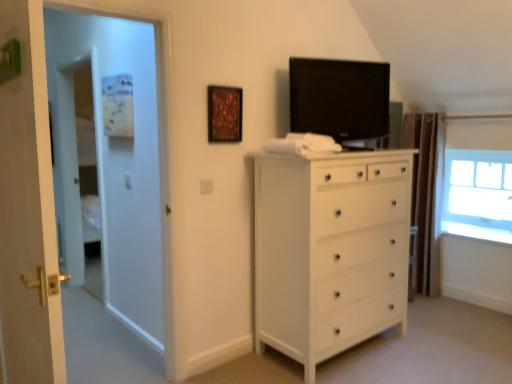
What do you see at coordinates (27, 208) in the screenshot?
I see `white wooden door at left` at bounding box center [27, 208].

Measure the distance between white glossy door at left and camera.

5.15 feet.

The width and height of the screenshot is (512, 384). Describe the element at coordinates (224, 114) in the screenshot. I see `wooden frame at upper center` at that location.

Describe the element at coordinates (477, 192) in the screenshot. Image resolution: width=512 pixels, height=384 pixels. I see `transparent glass window at upper right` at that location.

The image size is (512, 384). Describe the element at coordinates (330, 251) in the screenshot. I see `white wood chest of drawers at center` at that location.

Find the location of a particular element. white wooden door at left is located at coordinates (27, 208).

Is wooden frame at upper center further to the viewer compared to white glossy door at left?

Yes, it is.

How different are the orientations of wooden frame at upper center and white glossy door at left in degrees?

They differ by 2.53 degrees in their facing directions.

Where is `screen door located on the left of wooden frame at upper center`? screen door located on the left of wooden frame at upper center is located at coordinates (129, 159).

From a real-world perspective, is wooden frame at upper center physically above white glossy door at left?

Correct, in the physical world, wooden frame at upper center is higher than white glossy door at left.

Does brown textured curtain at right have a smaller size compared to black glossy tv at upper center?

No, brown textured curtain at right is not smaller than black glossy tv at upper center.

Is brown textured curtain at right located outside black glossy tv at upper center?

brown textured curtain at right lies outside black glossy tv at upper center's area.

Consider the image. Is brown textured curtain at right next to black glossy tv at upper center?

brown textured curtain at right and black glossy tv at upper center are clearly separated.

Is wooden frame at upper center with black glossy tv at upper center?

No.

Locate an element on the screen. picture frame below the black glossy tv at upper center (from the image's perspective) is located at coordinates (224, 114).

From a real-world perspective, which is physically above, wooden frame at upper center or black glossy tv at upper center?

In real-world perspective, black glossy tv at upper center is above.

In the scene shown: What's the angular difference between wooden frame at upper center and black glossy tv at upper center's facing directions?

The angular difference between wooden frame at upper center and black glossy tv at upper center is 12.7 degrees.

Does brown textured curtain at right turn towards white wooden door at left?

Yes, brown textured curtain at right faces towards white wooden door at left.

Considering the sizes of brown textured curtain at right and white wooden door at left in the image, is brown textured curtain at right wider or thinner than white wooden door at left?

Considering their sizes, brown textured curtain at right looks broader than white wooden door at left.

Does point (411, 263) appear closer or farther from the camera than point (27, 241)?

Point (411, 263) is positioned farther from the camera compared to point (27, 241).

Looking at this image, is brown textured curtain at right positioned far away from white wooden door at left?

Yes, brown textured curtain at right and white wooden door at left are quite far apart.

How many degrees apart are the facing directions of brown textured curtain at right and wooden frame at upper center?

90.1 degrees separate the facing orientations of brown textured curtain at right and wooden frame at upper center.

In the image, there is a wooden frame at upper center. Where is `curtain below it (from a real-world perspective)`? This screenshot has height=384, width=512. curtain below it (from a real-world perspective) is located at coordinates tap(425, 199).

Which is in front, point (413, 248) or point (239, 115)?

The point (239, 115) is more forward.

Is brown textured curtain at right located outside wooden frame at upper center?

Absolutely, brown textured curtain at right is external to wooden frame at upper center.

Which of these two, black glossy tv at upper center or transparent glass window at upper right, is thinner?

Thinner between the two is black glossy tv at upper center.

From a real-world perspective, which object rests below the other?

In real-world perspective, transparent glass window at upper right is lower.

Considering the positions of objects black glossy tv at upper center and transparent glass window at upper right in the image provided, who is behind, black glossy tv at upper center or transparent glass window at upper right?

transparent glass window at upper right is further away from the camera.

Does black glossy tv at upper center have a greater height compared to transparent glass window at upper right?

No, black glossy tv at upper center is not taller than transparent glass window at upper right.

Considering the sizes of objects brown textured curtain at right and white wood chest of drawers at center in the image provided, who is smaller, brown textured curtain at right or white wood chest of drawers at center?

Smaller between the two is brown textured curtain at right.

Which of these two, brown textured curtain at right or white wood chest of drawers at center, stands shorter?

white wood chest of drawers at center.

Consider the image. How different are the orientations of brown textured curtain at right and white wood chest of drawers at center in degrees?

There is a 87.6-degree angle between the facing directions of brown textured curtain at right and white wood chest of drawers at center.

Does brown textured curtain at right touch white wood chest of drawers at center?

brown textured curtain at right and white wood chest of drawers at center are clearly separated.

Identify the location of screen door that appears below the wooden frame at upper center (from a real-world perspective). (129, 159).

You are a GUI agent. You are given a task and a screenshot of the screen. Output one action in this format:
    pyautogui.click(x=<x>, y=<y>)
    Task: Click on the curtain that is below the black glossy tv at upper center (from the image's perspective)
    
    Given the screenshot: What is the action you would take?
    pyautogui.click(x=425, y=199)

Estimate the real-world distances between objects in this image. Which object is further from wooden frame at upper center, white glossy door at left or brown textured curtain at right?

The object further to wooden frame at upper center is brown textured curtain at right.

From the image, which object appears to be nearer to wooden frame at upper center, white glossy door at left or transparent glass window at upper right?

white glossy door at left is closer to wooden frame at upper center.

From the image, which object appears to be farther from white glossy door at left, black glossy tv at upper center or white wood chest of drawers at center?

black glossy tv at upper center lies further to white glossy door at left than the other object.

Considering their positions, is black glossy tv at upper center positioned closer to brown textured curtain at right than white wooden door at left?

Based on the image, black glossy tv at upper center appears to be nearer to brown textured curtain at right.

Consider the image. From the image, which object appears to be farther from wooden frame at upper center, transparent glass window at upper right or black glossy tv at upper center?

Among the two, transparent glass window at upper right is located further to wooden frame at upper center.

From the image, which object appears to be farther from white wood chest of drawers at center, white glossy door at left or white wooden door at left?

The object further to white wood chest of drawers at center is white wooden door at left.

Estimate the real-world distances between objects in this image. Which object is further from black glossy tv at upper center, brown textured curtain at right or transparent glass window at upper right?

Based on the image, transparent glass window at upper right appears to be further to black glossy tv at upper center.

Based on their spatial positions, is brown textured curtain at right or white wooden door at left closer to transparent glass window at upper right?

brown textured curtain at right is closer to transparent glass window at upper right.

Locate an element on the screen. This screenshot has height=384, width=512. chest of drawers between wooden frame at upper center and transparent glass window at upper right in the horizontal direction is located at coordinates (330, 251).

I want to click on chest of drawers between white wooden door at left and transparent glass window at upper right in the horizontal direction, so click(x=330, y=251).

The height and width of the screenshot is (384, 512). Find the location of `screen door located between white wooden door at left and transparent glass window at upper right in the left-right direction`. screen door located between white wooden door at left and transparent glass window at upper right in the left-right direction is located at coordinates (129, 159).

Identify the location of television between white wooden door at left and transparent glass window at upper right from left to right. The width and height of the screenshot is (512, 384). click(x=340, y=98).